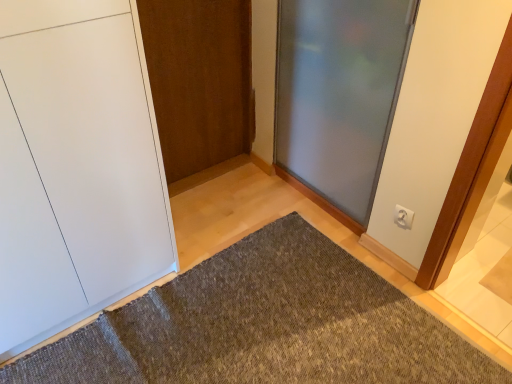
Identify the location of free location to the right of wooden door at center, which is counted as the 2th door, starting from the right. This screenshot has width=512, height=384. (249, 182).